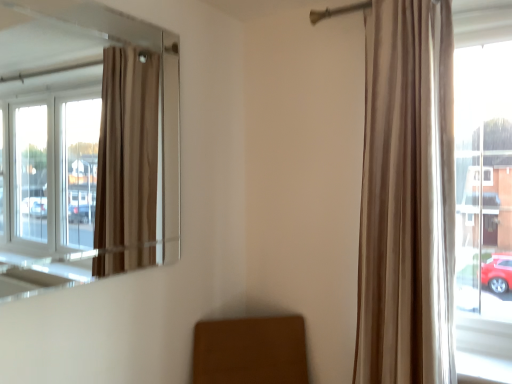
Question: In terms of height, does beige velvet curtain at right look taller or shorter compared to transparent glass window at upper left?

Choices:
 (A) short
 (B) tall

Answer: (B)

Question: In the image, is beige velvet curtain at right positioned in front of or behind transparent glass window at upper left?

Choices:
 (A) front
 (B) behind

Answer: (B)

Question: Considering the relative positions of beige velvet curtain at right and transparent glass window at upper left in the image provided, is beige velvet curtain at right to the left or to the right of transparent glass window at upper left?

Choices:
 (A) left
 (B) right

Answer: (B)

Question: In terms of width, does transparent glass window at upper left look wider or thinner when compared to beige velvet curtain at right?

Choices:
 (A) wide
 (B) thin

Answer: (B)

Question: Considering the positions of transparent glass window at upper left and beige velvet curtain at right in the image, is transparent glass window at upper left bigger or smaller than beige velvet curtain at right?

Choices:
 (A) small
 (B) big

Answer: (A)

Question: Would you say transparent glass window at upper left is inside or outside beige velvet curtain at right?

Choices:
 (A) inside
 (B) outside

Answer: (B)

Question: From the image's perspective, is transparent glass window at upper left above or below beige velvet curtain at right?

Choices:
 (A) below
 (B) above

Answer: (B)